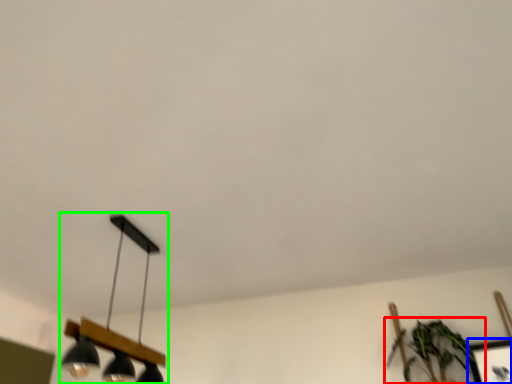
Question: Based on their relative distances, which object is nearer to houseplant (highlighted by a red box)? Choose from picture frame (highlighted by a blue box) and lamp (highlighted by a green box).

Choices:
 (A) picture frame
 (B) lamp

Answer: (A)